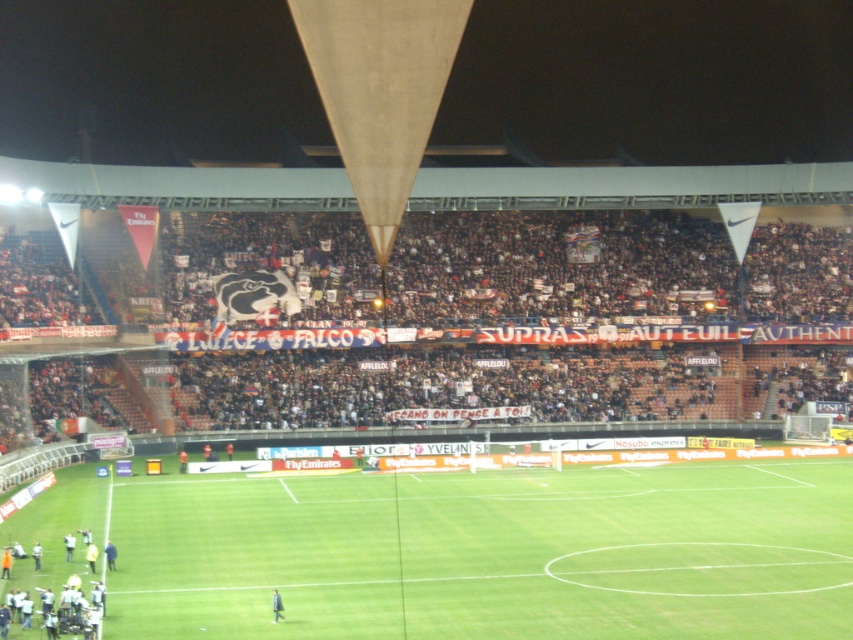
Which is above, green grass football field at center or yellow fabric person at lower left?

green grass football field at center is above.

Is green grass football field at center behind yellow fabric person at lower left?

No, green grass football field at center is closer to the viewer.

Is point (685, 584) positioned in front of point (109, 556)?

Yes, point (685, 584) is closer to viewer.

This screenshot has height=640, width=853. In order to click on green grass football field at center in this screenshot , I will do `click(489, 552)`.

Does yellow fabric person at lower left have a greater height compared to dark blue uniform at center?

In fact, yellow fabric person at lower left may be shorter than dark blue uniform at center.

Is point (109, 557) closer to viewer compared to point (73, 545)?

Yes, point (109, 557) is closer to viewer.

In order to click on yellow fabric person at lower left in this screenshot , I will do tap(109, 556).

Who is higher up, green grass football field at center or dark blue uniform at center?

green grass football field at center is above.

Is point (41, 531) positioned before point (68, 536)?

No.

Which is in front, point (144, 477) or point (68, 561)?

Point (68, 561)

You are a GUI agent. You are given a task and a screenshot of the screen. Output one action in this format:
    pyautogui.click(x=<x>, y=<y>)
    Task: Click on the green grass football field at center
    
    Given the screenshot: What is the action you would take?
    pyautogui.click(x=489, y=552)